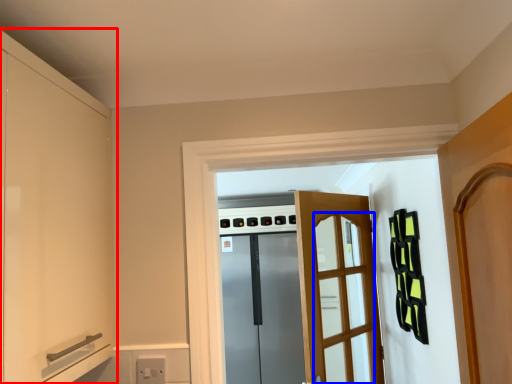
Question: Which object is closer to the camera taking this photo, cabinetry (highlighted by a red box) or screen door (highlighted by a blue box)?

Choices:
 (A) cabinetry
 (B) screen door

Answer: (A)